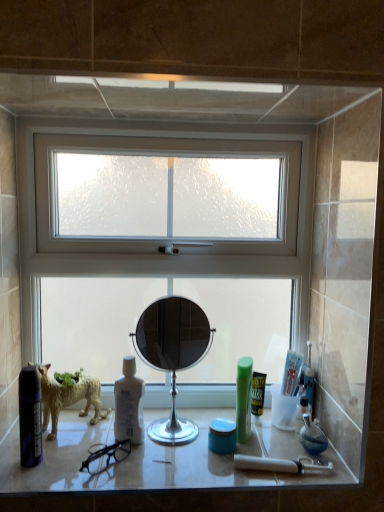
I want to click on empty space that is in between speckled ceramic figurine at lower left and matte black can at left, so click(x=63, y=450).